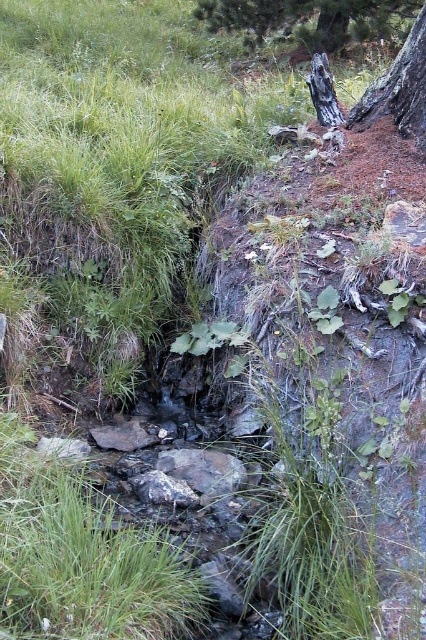
Question: Does green textured tree at upper center have a smaller size compared to smooth bark tree trunk at upper right?

Choices:
 (A) yes
 (B) no

Answer: (B)

Question: Is green textured tree at upper center smaller than smooth bark tree trunk at upper right?

Choices:
 (A) no
 (B) yes

Answer: (A)

Question: Which point is closer to the camera?

Choices:
 (A) smooth bark tree trunk at upper right
 (B) green textured tree at upper center

Answer: (A)

Question: Is green textured tree at upper center thinner than smooth bark tree trunk at upper right?

Choices:
 (A) yes
 (B) no

Answer: (B)

Question: Which of the following is the farthest from the observer?

Choices:
 (A) green textured tree at upper center
 (B) smooth bark tree trunk at upper right

Answer: (A)